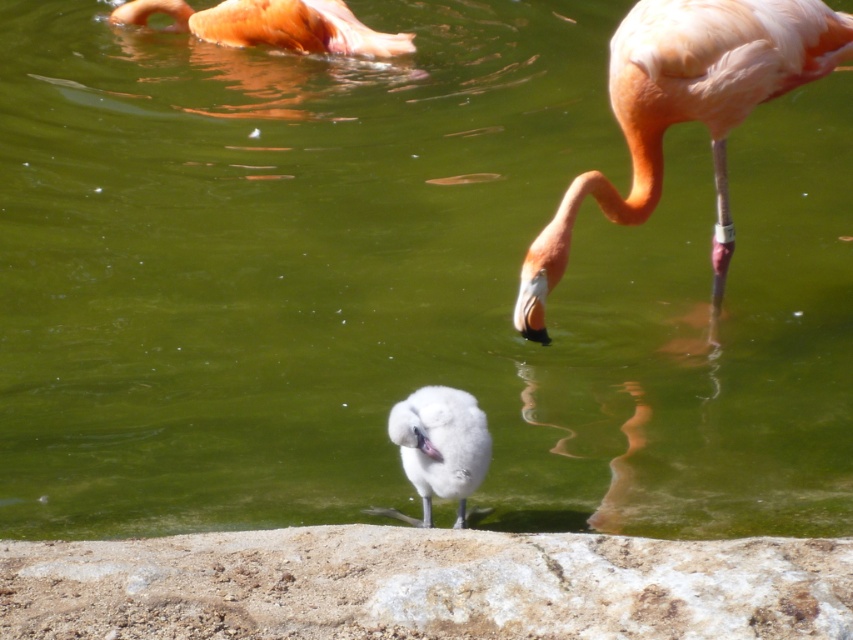
From the picture: Is matte pink flamingo at upper right bigger than orange matte flamingo at upper left?

Correct, matte pink flamingo at upper right is larger in size than orange matte flamingo at upper left.

Is matte pink flamingo at upper right further to camera compared to orange matte flamingo at upper left?

No.

Image resolution: width=853 pixels, height=640 pixels. Describe the element at coordinates (685, 109) in the screenshot. I see `matte pink flamingo at upper right` at that location.

Locate an element on the screen. The image size is (853, 640). matte pink flamingo at upper right is located at coordinates (685, 109).

Is point (132, 4) closer to camera compared to point (477, 422)?

No, it is not.

Which is in front, point (238, 29) or point (469, 483)?

Point (469, 483) is in front.

Locate an element on the screen. The image size is (853, 640). orange matte flamingo at upper left is located at coordinates (273, 26).

Who is shorter, matte pink flamingo at upper right or white fluffy bird at center?

white fluffy bird at center

Can you confirm if matte pink flamingo at upper right is positioned above white fluffy bird at center?

Correct, matte pink flamingo at upper right is located above white fluffy bird at center.

Does point (767, 61) lie behind point (447, 404)?

That is True.

Where is `matte pink flamingo at upper right`? Image resolution: width=853 pixels, height=640 pixels. matte pink flamingo at upper right is located at coordinates (685, 109).